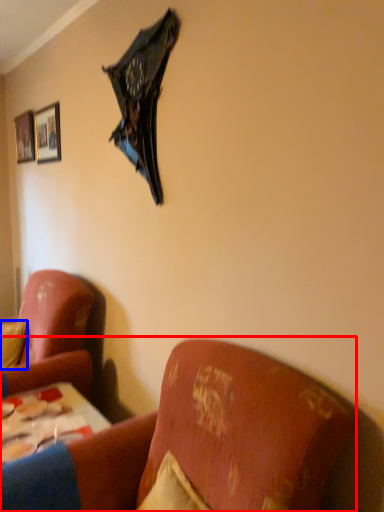
Question: Which point is closer to the camera, studio couch (highlighted by a red box) or pillow (highlighted by a blue box)?

Choices:
 (A) studio couch
 (B) pillow

Answer: (A)